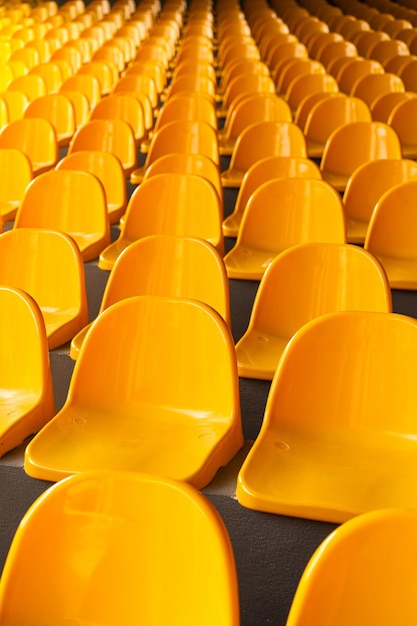
I want to click on chair platform, so [17, 496], [61, 367], [98, 280], [269, 570], [401, 297].